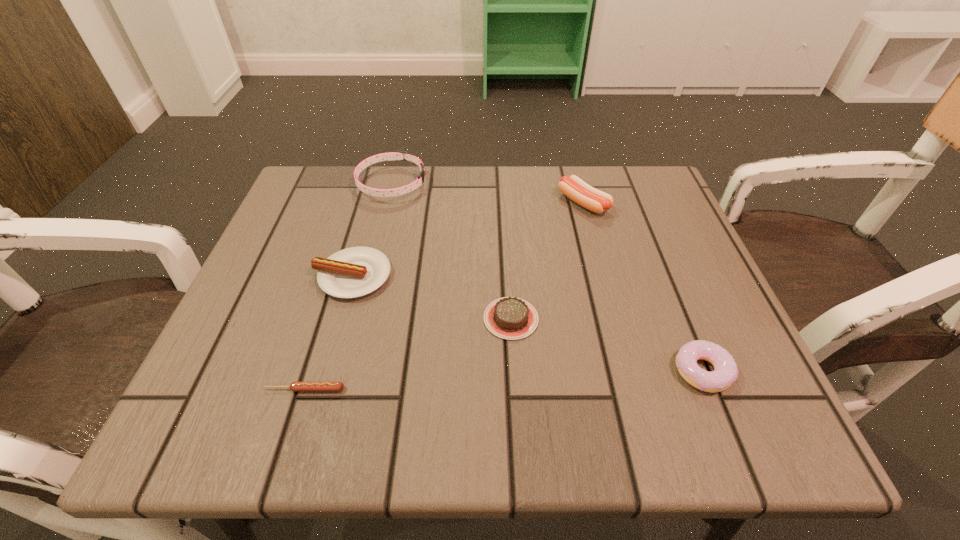
Identify the location of vacant region that satisfies the following two spatial constraints: 1. with the buckle on the third object from right to left; 2. on the right side of the dog collar. The height and width of the screenshot is (540, 960). (359, 319).

Where is `free space that satisfies the following two spatial constraints: 1. with the buckle on the dog collar; 2. on the back side of the rightmost sausage`? free space that satisfies the following two spatial constraints: 1. with the buckle on the dog collar; 2. on the back side of the rightmost sausage is located at coordinates point(387,203).